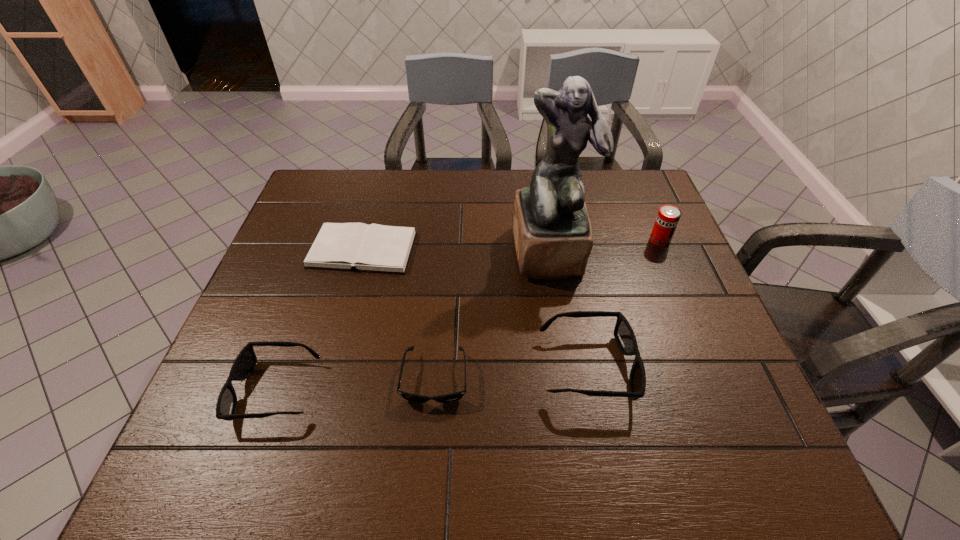
Locate an element on the screen. The width and height of the screenshot is (960, 540). free space that satisfies the following two spatial constraints: 1. in a relaxed pose on the tallest object; 2. on the front-facing side of the second shortest sunglasses is located at coordinates click(x=573, y=390).